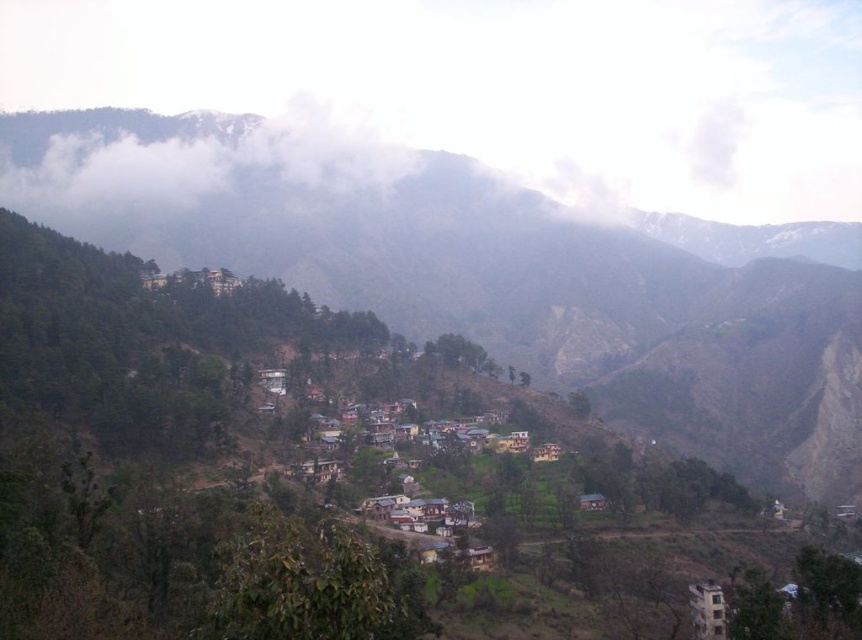
Is green textured hillside at center further to camera compared to white fluffy cloud at upper center?

No, it is in front of white fluffy cloud at upper center.

Does green textured hillside at center appear on the right side of white fluffy cloud at upper center?

Indeed, green textured hillside at center is positioned on the right side of white fluffy cloud at upper center.

Does point (859, 401) lie in front of point (14, 138)?

Yes, it is in front of point (14, 138).

This screenshot has height=640, width=862. Find the location of `green textured hillside at center`. green textured hillside at center is located at coordinates (522, 284).